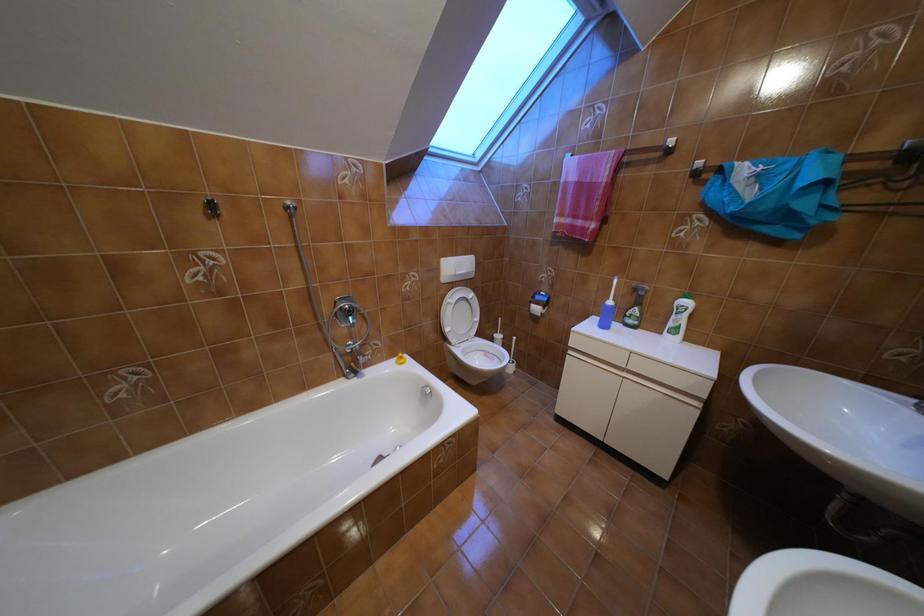
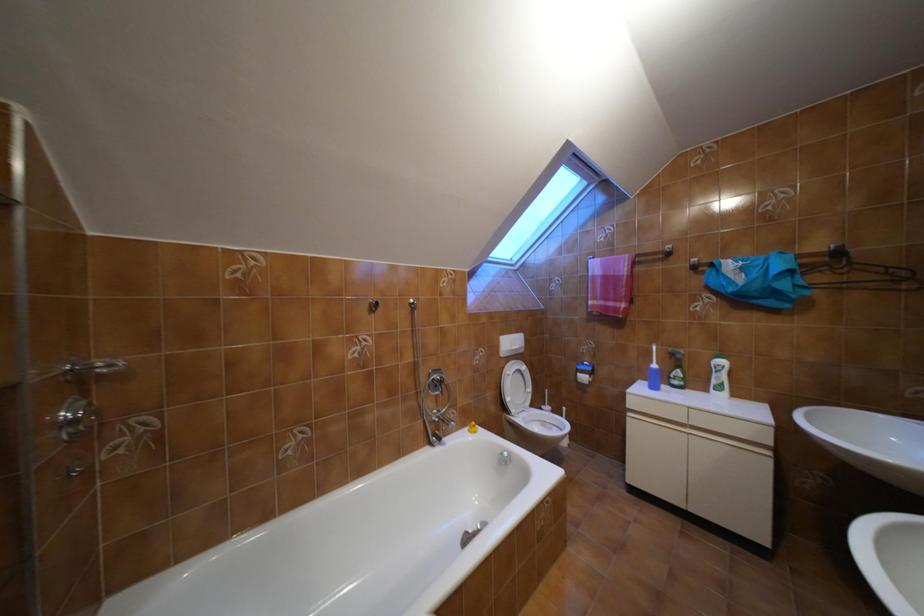
Which direction would the cameraman need to move to produce the second image?

The cameraman moved toward left, backward.